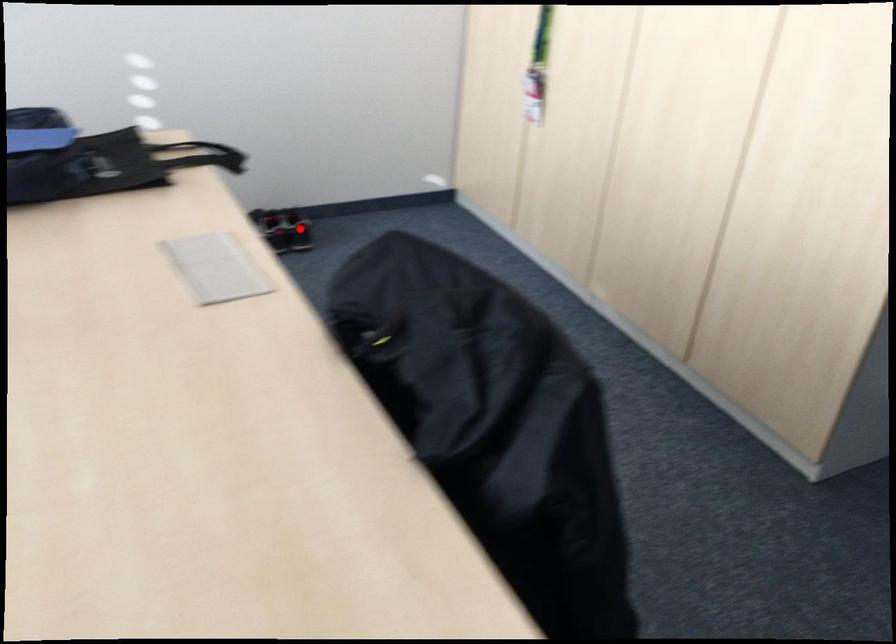
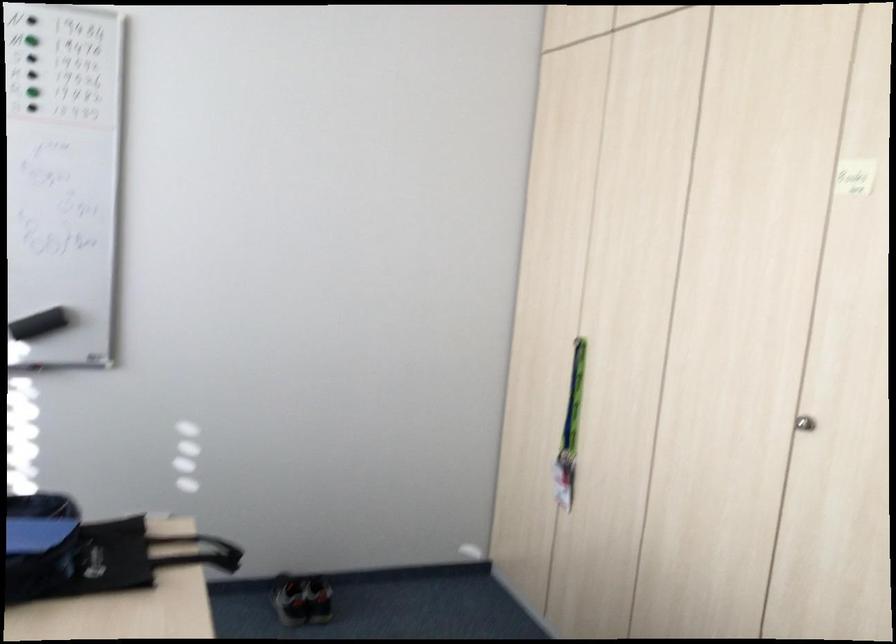
Where in the second image is the point corresponding to the highlighted location from the first image?

(319, 599)